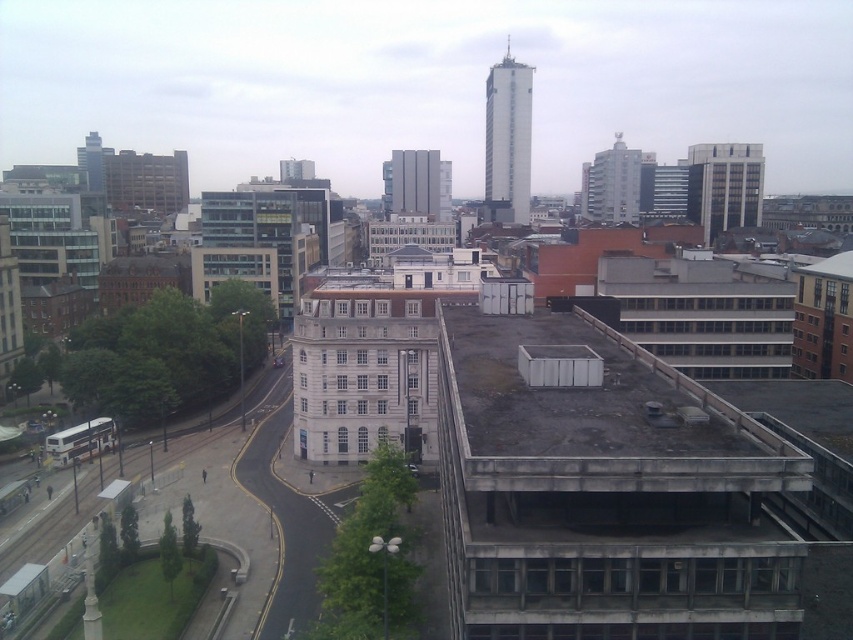
You are standing at the intersection in the urban landscape image. You see a matte gray building at upper right. Which direction should you face to look towards the point marked at coordinates (612, 184)?

The point at coordinates (612, 184) corresponds to the matte gray building at upper right, so you should face towards the upper right direction to look towards that point.

You are an urban planner analyzing this area. You need to install a new streetlight between the matte gray building at upper right and the matte glass skyscraper at upper left. Which building should the streetlight be closer to if it must be placed closer to the smaller one?

The matte gray building at upper right is smaller than the matte glass skyscraper at upper left, so the streetlight should be placed closer to the matte gray building at upper right.

From the picture: You are a city planner assessing the urban layout. You need to determine which building, the white glass building at upper center or the gray concrete building at center, would cast a longer shadow at noon. Based on their positions and the sun angle, which one would cast a longer shadow?

The white glass building at upper center has a greater height compared to the gray concrete building at center. Since taller objects cast longer shadows when the sun angle is the same, the white glass building at upper center would cast a longer shadow at noon.